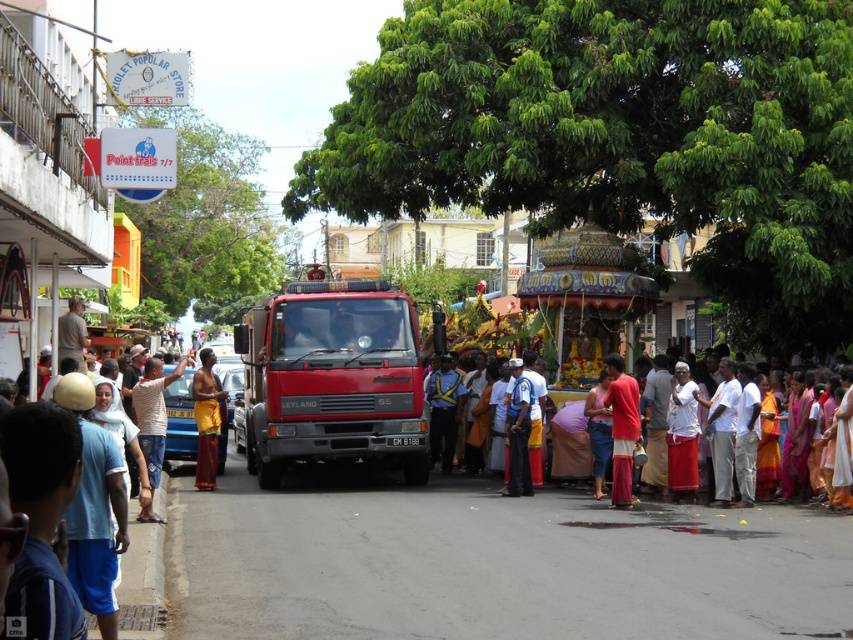
Based on the photo, between white striped shirt at center and light blue uniform at center, which one appears on the right side from the viewer's perspective?

light blue uniform at center is more to the right.

Can you confirm if white striped shirt at center is shorter than light blue uniform at center?

Yes.

In order to click on white striped shirt at center in this screenshot , I will do (x=154, y=422).

Who is positioned more to the right, white striped shirt at center or yellow fabric cloth at center?

From the viewer's perspective, white striped shirt at center appears more on the right side.

Between white striped shirt at center and yellow fabric cloth at center, which one is positioned higher?

yellow fabric cloth at center is above.

Between point (157, 448) and point (196, 403), which one is positioned in front?

Point (157, 448) is in front.

Image resolution: width=853 pixels, height=640 pixels. I want to click on white striped shirt at center, so click(154, 422).

Can you confirm if red matte truck at center is taller than white cotton shirt at right?

No.

Looking at this image, who is positioned more to the left, red matte truck at center or white cotton shirt at right?

red matte truck at center

Which is behind, point (265, 330) or point (674, 365)?

Positioned behind is point (265, 330).

Identify the location of red matte truck at center. (332, 378).